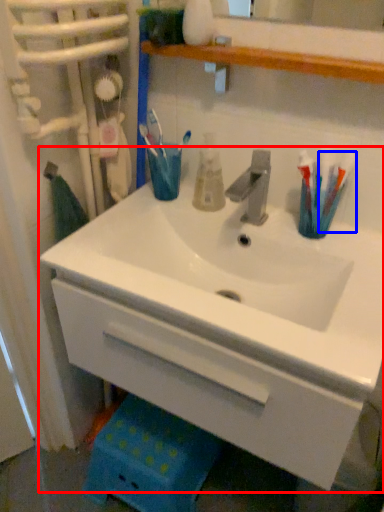
Question: Which object appears closest to the camera in this image, sink (highlighted by a red box) or toothbrush (highlighted by a blue box)?

Choices:
 (A) sink
 (B) toothbrush

Answer: (A)